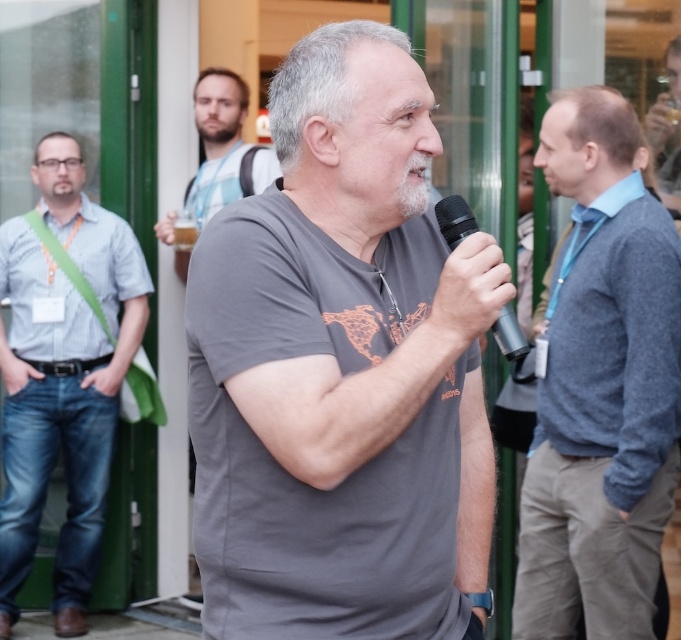
Question: Is gray matte t-shirt at center positioned at the back of matte black shirt at center?

Choices:
 (A) yes
 (B) no

Answer: (B)

Question: Does gray matte t-shirt at center appear on the right side of black metallic microphone at center?

Choices:
 (A) yes
 (B) no

Answer: (B)

Question: Which of the following is the farthest from the observer?

Choices:
 (A) (25, 272)
 (B) (217, 184)

Answer: (B)

Question: Which of the following is the farthest from the observer?

Choices:
 (A) gray wool sweater at center
 (B) gray matte t-shirt at center

Answer: (A)

Question: Is beige striped shirt at upper center smaller than black metallic microphone at center?

Choices:
 (A) no
 (B) yes

Answer: (A)

Question: Which object is closer to the camera taking this photo?

Choices:
 (A) gray matte t-shirt at center
 (B) blue striped shirt at left

Answer: (A)